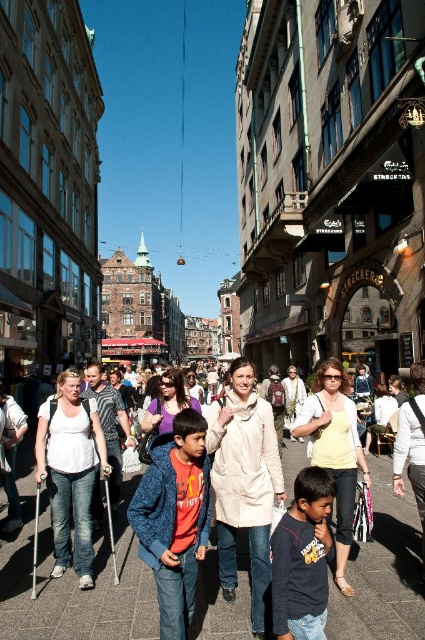
You are a delivery robot navigating a European city street. You need to deliver a package to a location marked by coordinates. The destination is at point 0.920, 0.176. You see smooth concrete pavement at center. Can you reach the destination without leaving the pavement?

Yes, the destination at point (74, 588) is located on the smooth concrete pavement at center, so the delivery robot can reach it without leaving the pavement.

You are a photographer standing on a European street with historic buildings. You see a person wearing a blue fleece jacket at center and another wearing a dark blue cotton shirt at center. If you want to take a photo that includes both, which clothing item should you focus on to ensure the taller one is properly framed?

The blue fleece jacket at center is taller than the dark blue cotton shirt at center. To ensure the taller one is properly framed, focus on the blue fleece jacket at center.

You are a photographer standing at the edge of the street. You want to capture a photo of the blue fleece jacket at center without including any other people in the frame. Given that your camera has a 50mm lens, which has a field of view of approximately 46 degrees, can you estimate whether the jacket is within the frame if you aim directly at it?

The blue fleece jacket at center is positioned at point coordinates of (175, 518). Since the photographer is aiming directly at the jacket, it should be within the frame as long as the jacket is within the 46 degree field of view. However, without additional information about the distance between the photographer and the jacket, it is impossible to definitively confirm if the jacket will fit within the frame.